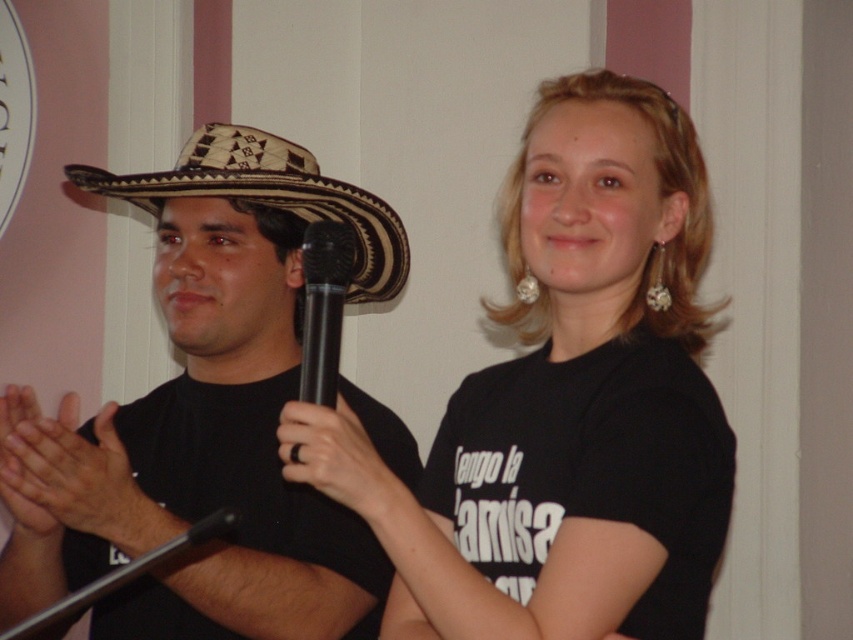
Does smooth skin hands at center have a lesser height compared to black matte ring at center?

No.

Looking at this image, which is above, smooth skin hands at center or black matte ring at center?

black matte ring at center is above.

Is point (74, 436) less distant than point (347, 451)?

No, it is not.

You are a GUI agent. You are given a task and a screenshot of the screen. Output one action in this format:
    pyautogui.click(x=<x>, y=<y>)
    Task: Click on the smooth skin hands at center
    
    Given the screenshot: What is the action you would take?
    pyautogui.click(x=73, y=486)

Is smooth skin hands at center wider than woven straw cowboy hat at left?

No, smooth skin hands at center is not wider than woven straw cowboy hat at left.

Can you confirm if smooth skin hands at center is positioned to the left of woven straw cowboy hat at left?

Indeed, smooth skin hands at center is positioned on the left side of woven straw cowboy hat at left.

This screenshot has width=853, height=640. What do you see at coordinates (73, 486) in the screenshot? I see `smooth skin hands at center` at bounding box center [73, 486].

At what (x,y) coordinates should I click in order to perform the action: click on smooth skin hands at center. Please return your answer as a coordinate pair (x, y). The height and width of the screenshot is (640, 853). Looking at the image, I should click on (73, 486).

Does woven straw cowboy hat at left come in front of black plastic microphone at center?

That is False.

Can you confirm if woven straw cowboy hat at left is wider than black plastic microphone at center?

Yes, woven straw cowboy hat at left is wider than black plastic microphone at center.

This screenshot has height=640, width=853. Describe the element at coordinates (270, 195) in the screenshot. I see `woven straw cowboy hat at left` at that location.

Locate an element on the screen. woven straw cowboy hat at left is located at coordinates (270, 195).